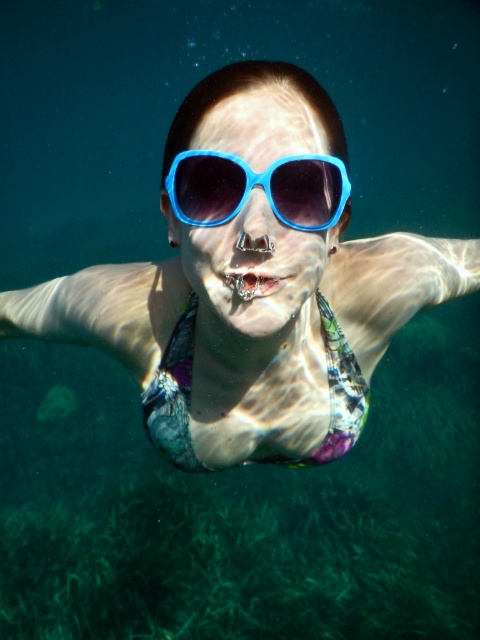
Question: Which point appears farthest from the camera in this image?

Choices:
 (A) (348, 442)
 (B) (266, 176)

Answer: (A)

Question: Which point is farther from the camera taking this photo?

Choices:
 (A) (182, 157)
 (B) (305, 458)

Answer: (B)

Question: Does multicolored fabric bikini at center lie in front of blue plastic goggles at center?

Choices:
 (A) no
 (B) yes

Answer: (A)

Question: Does multicolored fabric bikini at center have a larger size compared to blue plastic goggles at center?

Choices:
 (A) yes
 (B) no

Answer: (A)

Question: Does multicolored fabric bikini at center have a lesser width compared to blue plastic goggles at center?

Choices:
 (A) no
 (B) yes

Answer: (A)